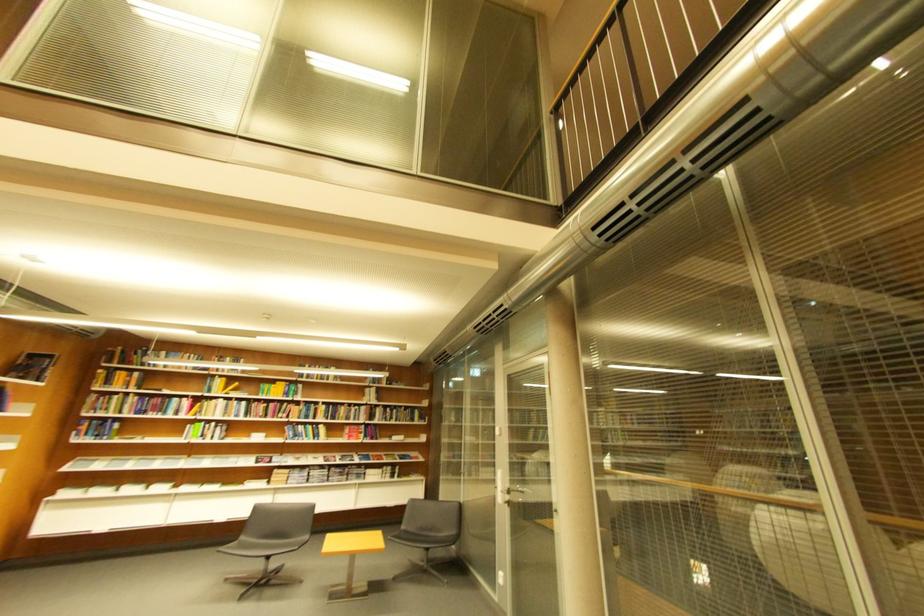
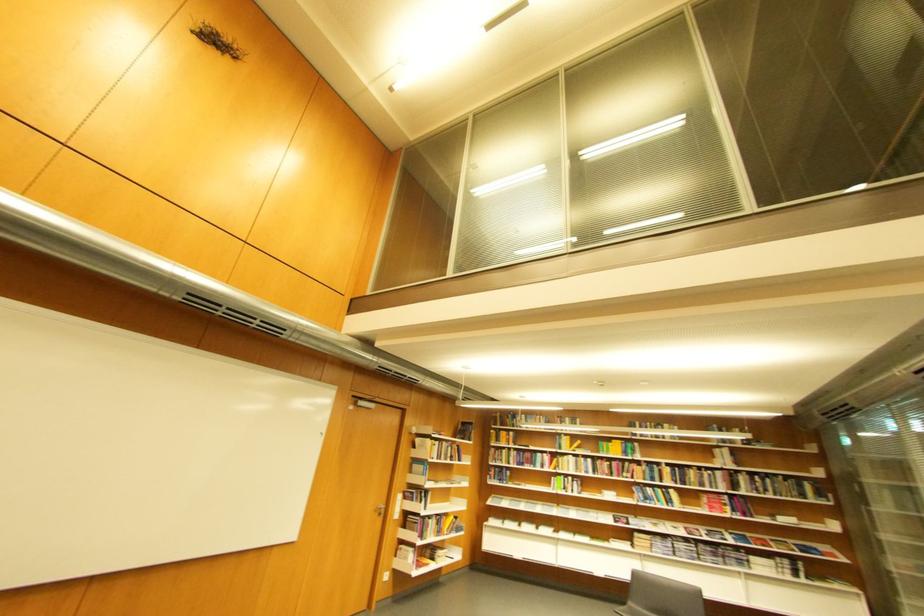
Find the pixel in the second image that matches point 187,415 in the first image.

(553, 468)